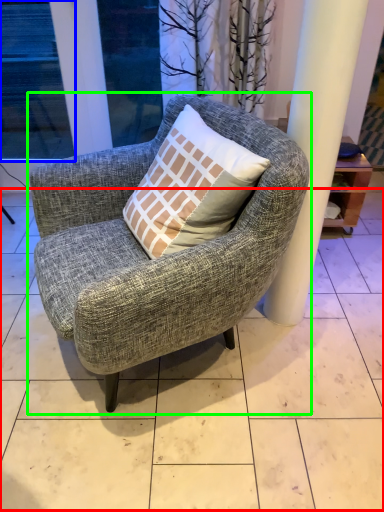
Question: Which object is the closest to the tile (highlighted by a red box)? Choose among these: window (highlighted by a blue box) or chair (highlighted by a green box).

Choices:
 (A) window
 (B) chair

Answer: (B)